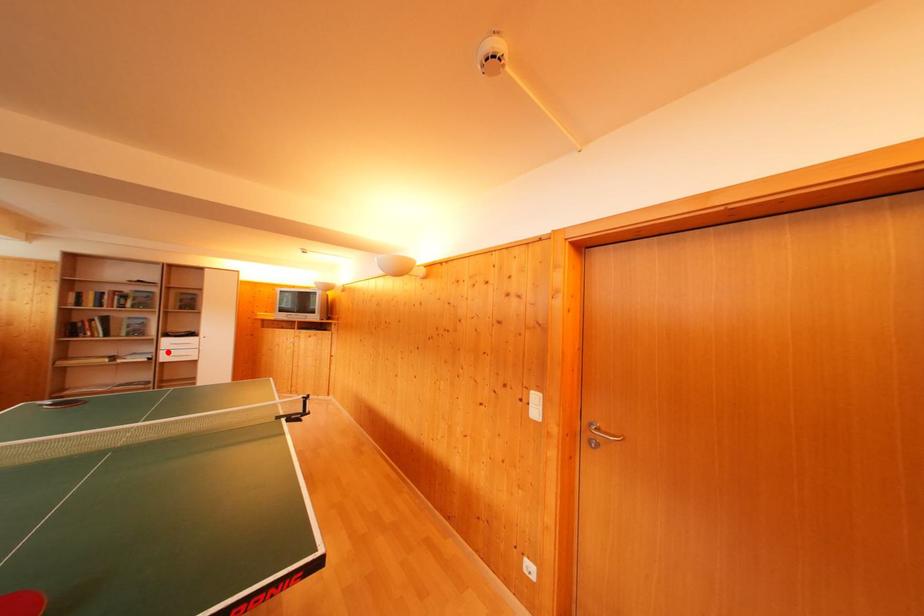
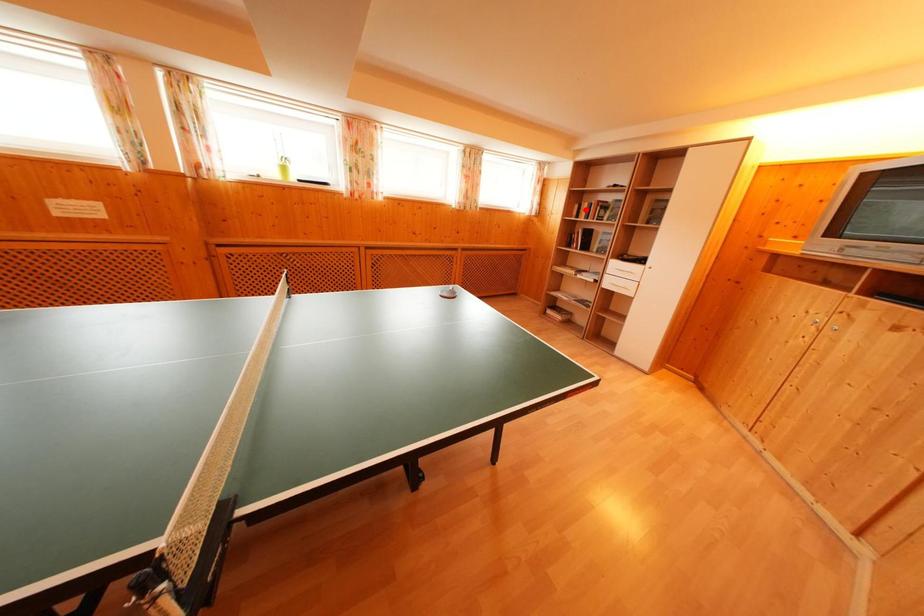
Looking at this image, I am providing you with two images of the same scene from different viewpoints. A red point is marked on the first image and another point is marked on the second image. Are the points marked in image1 and image2 representing the same 3D position?

No